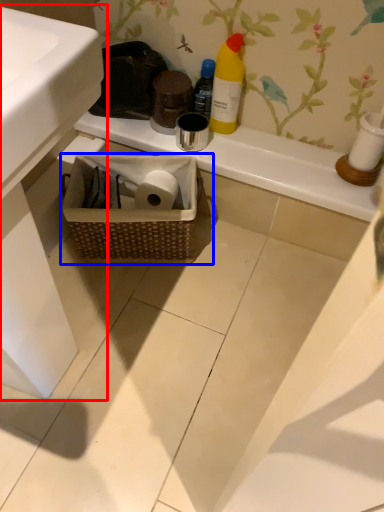
Question: Which point is further to the camera, sink (highlighted by a red box) or picnic basket (highlighted by a blue box)?

Choices:
 (A) sink
 (B) picnic basket

Answer: (B)